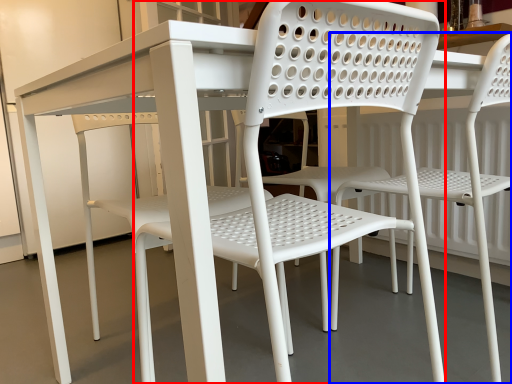
Question: Which object is closer to the camera taking this photo, chair (highlighted by a red box) or chair (highlighted by a blue box)?

Choices:
 (A) chair
 (B) chair

Answer: (A)